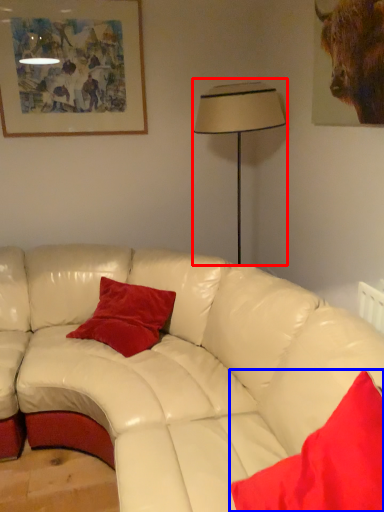
Question: Which object appears closest to the camera in this image, table lamp (highlighted by a red box) or pillow (highlighted by a blue box)?

Choices:
 (A) table lamp
 (B) pillow

Answer: (B)